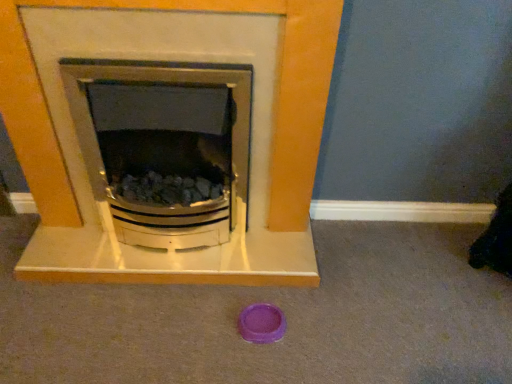
At what (x,y) coordinates should I click in order to perform the action: click on free space in front of matte white fireplace at center. Please return your answer as a coordinate pair (x, y). This screenshot has width=512, height=384. Looking at the image, I should click on (153, 327).